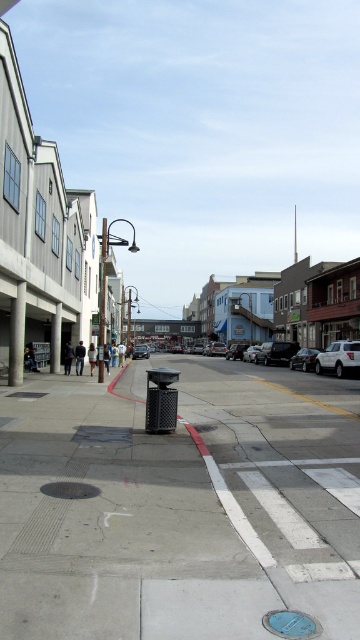
Which is more to the left, shiny silver sedan at center-right or metallic silver sedan at center?

From the viewer's perspective, metallic silver sedan at center appears more on the left side.

Is point (297, 360) in front of point (141, 352)?

Yes, point (297, 360) is in front of point (141, 352).

Where is `shiny silver sedan at center-right`? shiny silver sedan at center-right is located at coordinates (303, 358).

Is the position of white matte car at right more distant than that of shiny silver sedan at center-right?

No, white matte car at right is in front of shiny silver sedan at center-right.

Does white matte car at right appear on the right side of shiny silver sedan at center-right?

Yes, white matte car at right is to the right of shiny silver sedan at center-right.

Does point (321, 358) come in front of point (303, 349)?

Yes, point (321, 358) is closer to viewer.

This screenshot has height=640, width=360. In order to click on white matte car at right in this screenshot , I will do `click(339, 356)`.

Is white matte car at right below metallic silver sedan at center?

No, white matte car at right is not below metallic silver sedan at center.

Is white matte car at right to the right of metallic silver sedan at center from the viewer's perspective?

Indeed, white matte car at right is positioned on the right side of metallic silver sedan at center.

Is point (317, 362) farther from camera compared to point (149, 353)?

No, (317, 362) is closer to viewer.

At what (x,y) coordinates should I click in order to perform the action: click on white matte car at right. Please return your answer as a coordinate pair (x, y). Looking at the image, I should click on (339, 356).